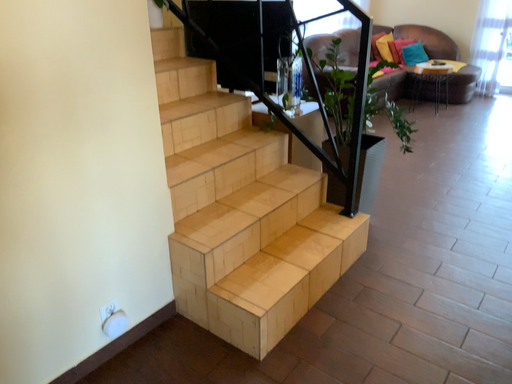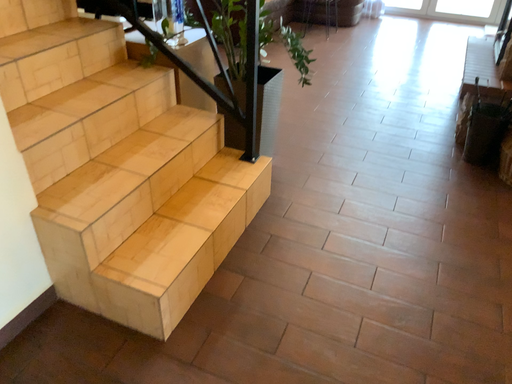
Question: How did the camera likely rotate when shooting the video?

Choices:
 (A) rotated downward
 (B) rotated upward

Answer: (A)